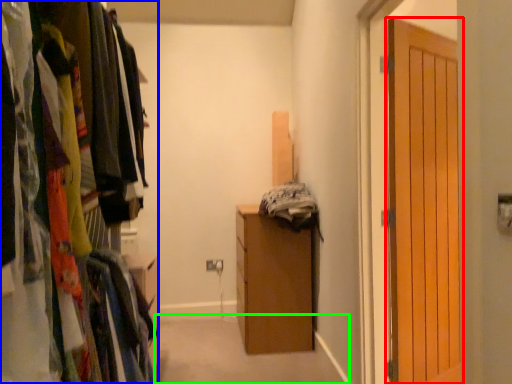
Question: Based on their relative distances, which object is nearer to door (highlighted by a red box)? Choose from cabinetry (highlighted by a blue box) and path (highlighted by a green box).

Choices:
 (A) cabinetry
 (B) path

Answer: (B)